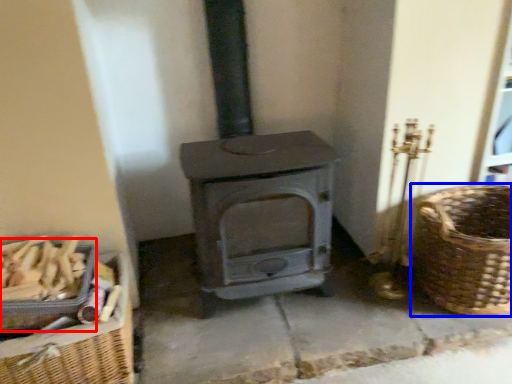
Question: Which point is further to the camera, basket (highlighted by a red box) or basket (highlighted by a blue box)?

Choices:
 (A) basket
 (B) basket

Answer: (B)